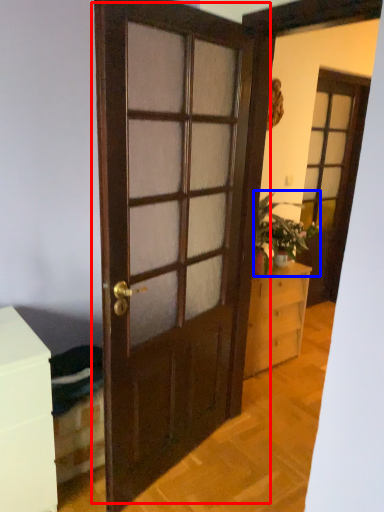
Question: Among these objects, which one is farthest to the camera, door (highlighted by a red box) or houseplant (highlighted by a blue box)?

Choices:
 (A) door
 (B) houseplant

Answer: (B)